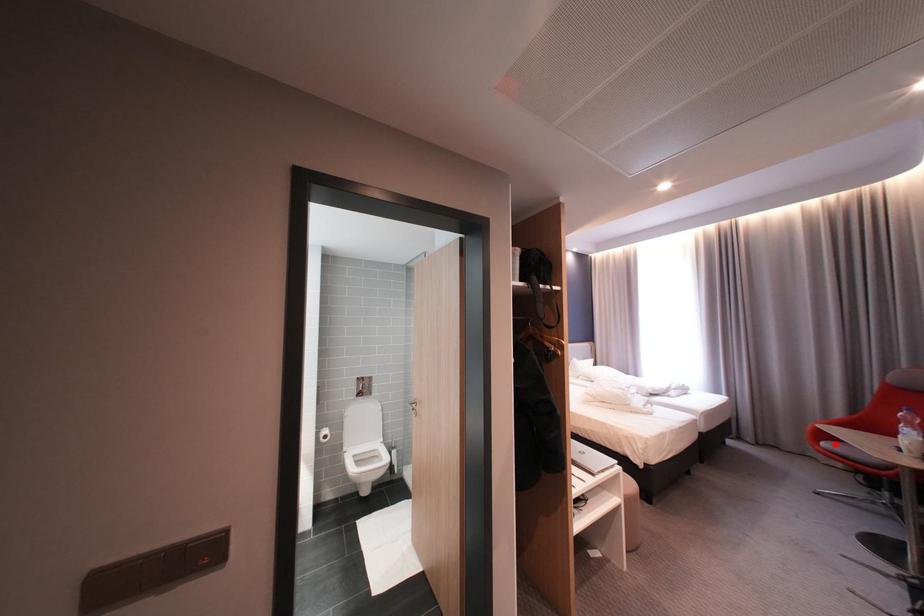
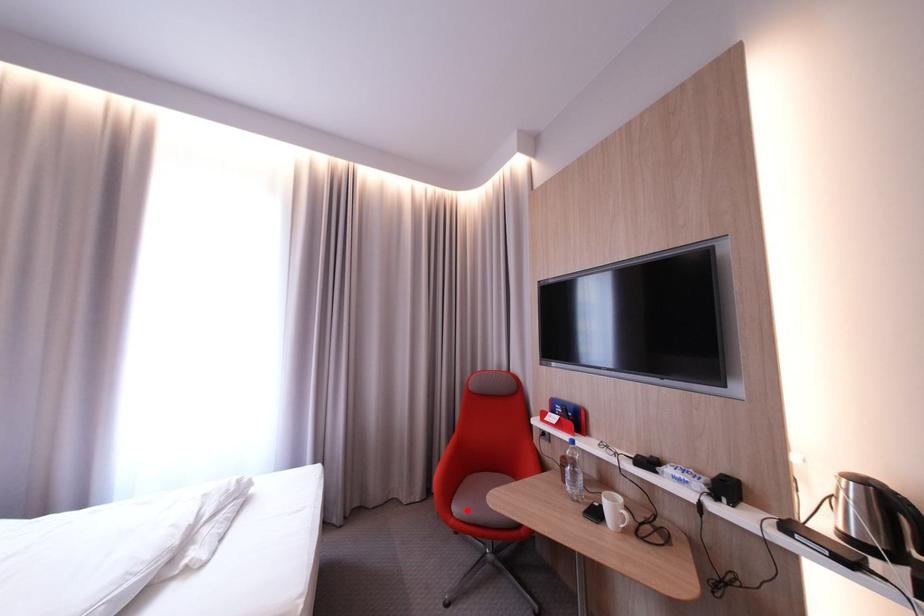
I am providing you with two images of the same scene from different viewpoints. A red point is marked on the first image and another point is marked on the second image. Do the highlighted points in image1 and image2 indicate the same real-world spot?

Yes